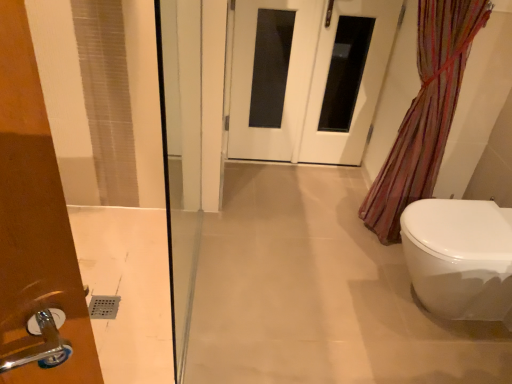
Question: Is translucent striped fabric at right smaller than white glossy door at center?

Choices:
 (A) yes
 (B) no

Answer: (B)

Question: Considering the relative sizes of translucent striped fabric at right and white glossy door at center in the image provided, is translucent striped fabric at right wider than white glossy door at center?

Choices:
 (A) no
 (B) yes

Answer: (B)

Question: From the image's perspective, is translucent striped fabric at right above white glossy door at center?

Choices:
 (A) no
 (B) yes

Answer: (A)

Question: Does translucent striped fabric at right appear on the left side of white glossy door at center?

Choices:
 (A) yes
 (B) no

Answer: (B)

Question: Is translucent striped fabric at right thinner than white glossy door at center?

Choices:
 (A) no
 (B) yes

Answer: (A)

Question: Does translucent striped fabric at right turn towards white glossy door at center?

Choices:
 (A) no
 (B) yes

Answer: (A)

Question: From a real-world perspective, does white glossy door at center stand above translucent striped fabric at right?

Choices:
 (A) yes
 (B) no

Answer: (B)

Question: Is white glossy door at center far away from translucent striped fabric at right?

Choices:
 (A) yes
 (B) no

Answer: (B)

Question: From the image's perspective, is white glossy door at center below translucent striped fabric at right?

Choices:
 (A) yes
 (B) no

Answer: (B)

Question: Considering the relative sizes of white glossy door at center and translucent striped fabric at right in the image provided, is white glossy door at center bigger than translucent striped fabric at right?

Choices:
 (A) yes
 (B) no

Answer: (B)

Question: Could you tell me if white glossy door at center is turned towards translucent striped fabric at right?

Choices:
 (A) no
 (B) yes

Answer: (B)

Question: Considering the relative sizes of white glossy door at center and translucent striped fabric at right in the image provided, is white glossy door at center taller than translucent striped fabric at right?

Choices:
 (A) yes
 (B) no

Answer: (B)

Question: Can you confirm if white glossy door at center is bigger than white glossy toilet at lower right?

Choices:
 (A) no
 (B) yes

Answer: (A)